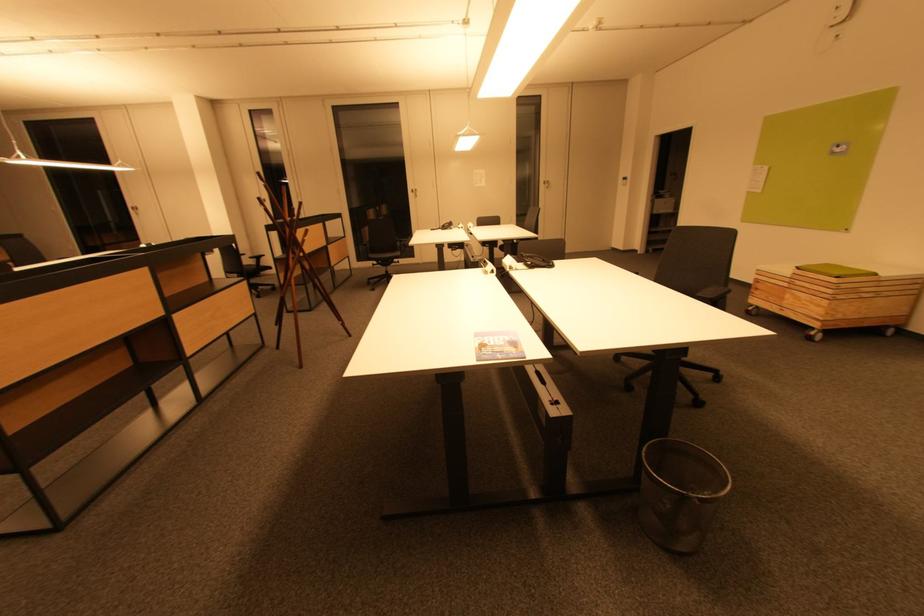
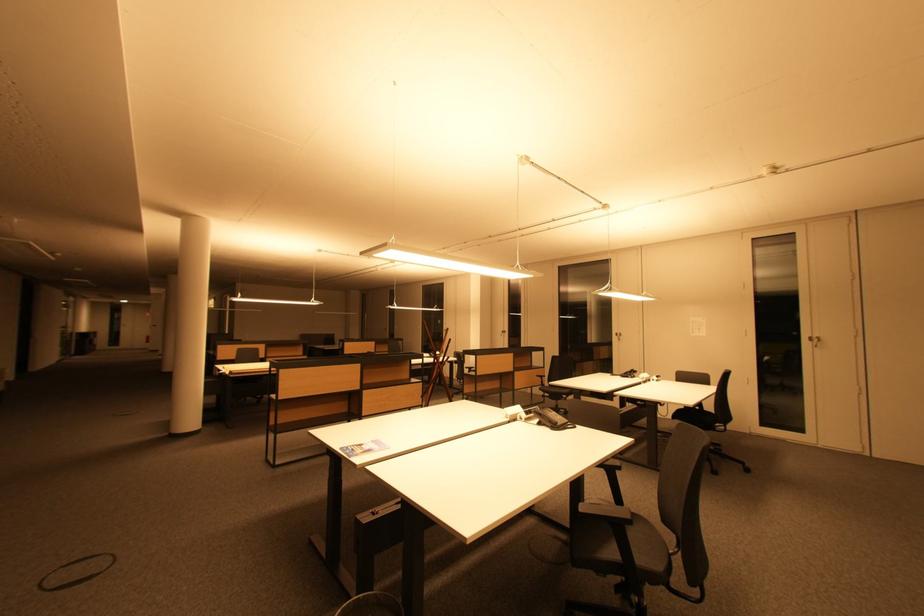
Locate, in the second image, the point that corresponds to [548,182] in the first image.

(815, 338)